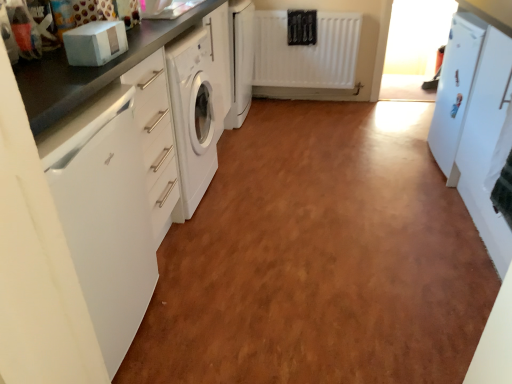
Question: Considering the relative positions of white matte refrigerator at right, acting as the second cabinetry starting from the left, and white glossy countertop at left in the image provided, is white matte refrigerator at right, acting as the second cabinetry starting from the left, behind white glossy countertop at left?

Choices:
 (A) no
 (B) yes

Answer: (A)

Question: Is white matte refrigerator at right, placed as the first cabinetry when sorted from right to left, wider than white glossy countertop at left?

Choices:
 (A) no
 (B) yes

Answer: (A)

Question: Could you tell me if white matte refrigerator at right, arranged as the 1th cabinetry when ordered from the bottom, is facing white glossy countertop at left?

Choices:
 (A) no
 (B) yes

Answer: (B)

Question: Does white matte refrigerator at right, which is the second cabinetry in top-to-bottom order, have a larger size compared to white glossy countertop at left?

Choices:
 (A) yes
 (B) no

Answer: (A)

Question: Is white glossy countertop at left at the back of white matte refrigerator at right, acting as the second cabinetry starting from the left?

Choices:
 (A) no
 (B) yes

Answer: (A)

Question: Does point (41, 120) appear closer or farther from the camera than point (232, 94)?

Choices:
 (A) closer
 (B) farther

Answer: (A)

Question: Is matte black countertop at left in front of or behind white glossy washing machine at center, positioned as the 1th cabinetry in top-to-bottom order, in the image?

Choices:
 (A) behind
 (B) front

Answer: (B)

Question: From the image's perspective, is matte black countertop at left above or below white glossy washing machine at center, acting as the 1th cabinetry starting from the left?

Choices:
 (A) above
 (B) below

Answer: (B)

Question: In terms of width, does matte black countertop at left look wider or thinner when compared to white glossy washing machine at center, which is the first cabinetry in back-to-front order?

Choices:
 (A) thin
 (B) wide

Answer: (B)

Question: In terms of width, does matte black countertop at left look wider or thinner when compared to white glossy dishwasher at left?

Choices:
 (A) wide
 (B) thin

Answer: (A)

Question: Looking at the image, does matte black countertop at left seem bigger or smaller compared to white glossy dishwasher at left?

Choices:
 (A) big
 (B) small

Answer: (A)

Question: Considering the positions of matte black countertop at left and white glossy dishwasher at left in the image, is matte black countertop at left taller or shorter than white glossy dishwasher at left?

Choices:
 (A) tall
 (B) short

Answer: (A)

Question: Relative to white glossy dishwasher at left, is matte black countertop at left in front or behind?

Choices:
 (A) behind
 (B) front

Answer: (A)

Question: Would you say white glossy dishwasher at left is inside or outside white matte refrigerator at right, which is the second cabinetry in top-to-bottom order?

Choices:
 (A) inside
 (B) outside

Answer: (B)

Question: Looking at the image, does white glossy dishwasher at left seem bigger or smaller compared to white matte refrigerator at right, acting as the second cabinetry starting from the left?

Choices:
 (A) small
 (B) big

Answer: (A)